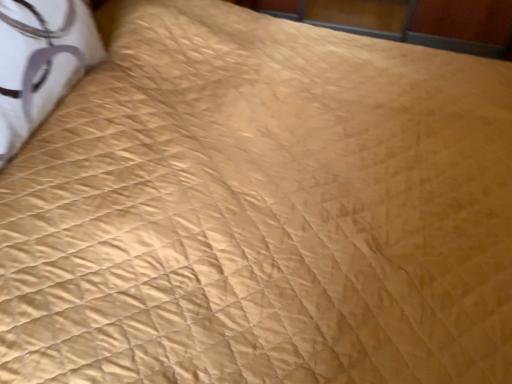
This screenshot has width=512, height=384. What do you see at coordinates (40, 62) in the screenshot?
I see `beige quilted pillow at upper left` at bounding box center [40, 62].

Measure the distance between point (25, 12) and camera.

The depth of point (25, 12) is 89.50 centimeters.

Identify the location of beige quilted pillow at upper left. (40, 62).

What is the approximate height of beige quilted pillow at upper left?

12.55 inches.

This screenshot has height=384, width=512. What are the coordinates of `beige quilted pillow at upper left` in the screenshot? It's located at (40, 62).